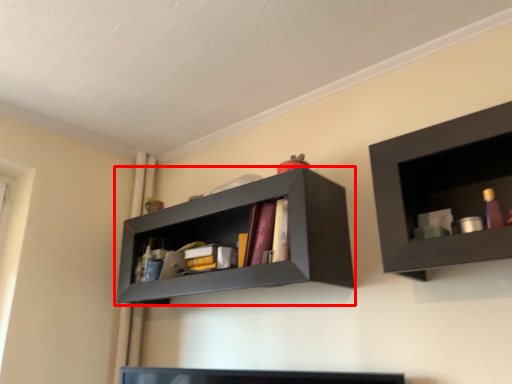
Question: In this image, where is shelf (annotated by the red box) located relative to shelf?

Choices:
 (A) left
 (B) right

Answer: (A)